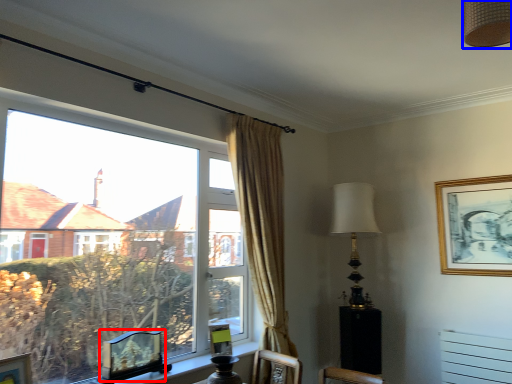
Question: Which point is further to the camera, picture frame (highlighted by a red box) or lamp (highlighted by a blue box)?

Choices:
 (A) picture frame
 (B) lamp

Answer: (A)